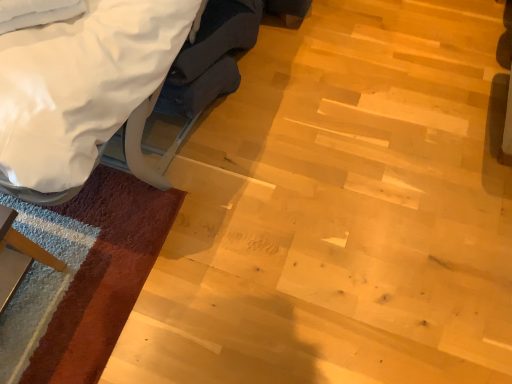
In order to click on white fabric swivel chair at upper left in this screenshot , I will do `click(188, 88)`.

This screenshot has height=384, width=512. What do you see at coordinates (188, 88) in the screenshot?
I see `white fabric swivel chair at upper left` at bounding box center [188, 88].

Find the location of a particular element. The image size is (512, 384). white fabric swivel chair at upper left is located at coordinates (188, 88).